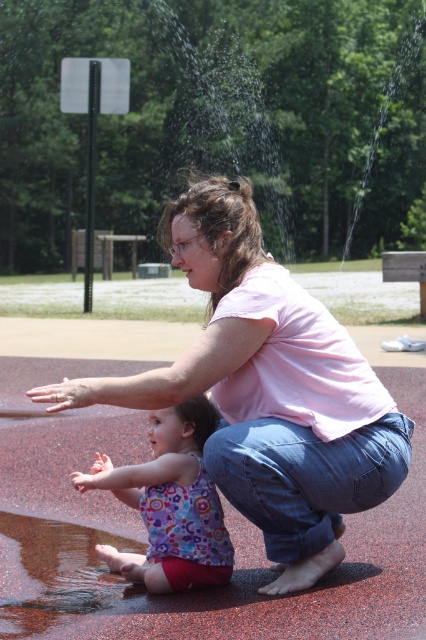
Consider the image. You are a clothing designer observing a mother and child at a playground. You notice the pink cotton shirt at center and the floral tank top at center. Which clothing item is bigger in size?

The pink cotton shirt at center is larger in size compared to the floral tank top at center.

You are a photographer trying to capture a candid shot of the woman and child in the playground scene. You notice the pink cotton shirt at center and the floral tank top at center. Which clothing item is positioned higher relative to the other?

The pink cotton shirt at center is above the floral tank top at center, so the pink cotton shirt at center is positioned higher.